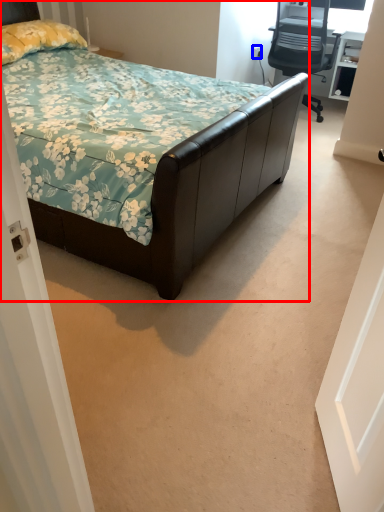
Question: Among these objects, which one is nearest to the camera, bed (highlighted by a red box) or power outlet (highlighted by a blue box)?

Choices:
 (A) bed
 (B) power outlet

Answer: (A)